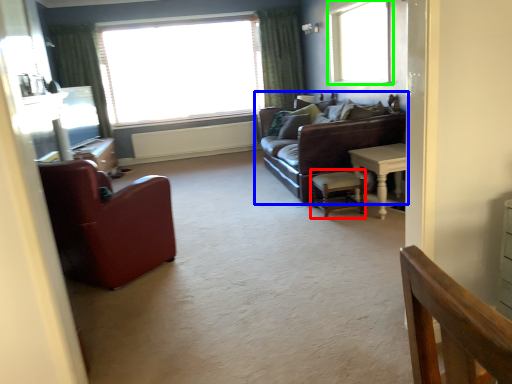
Question: Based on their relative distances, which object is nearer to chair (highlighted by a red box)? Choose from studio couch (highlighted by a blue box) and window (highlighted by a green box).

Choices:
 (A) studio couch
 (B) window

Answer: (A)